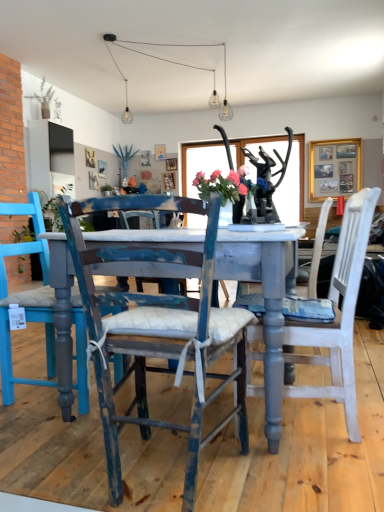
This screenshot has width=384, height=512. I want to click on white painted wood chair at center, which is counted as the second chair, starting from the left, so click(338, 314).

Where is `green leafy plant at upper center, acting as the 1th plant starting from the back`? green leafy plant at upper center, acting as the 1th plant starting from the back is located at coordinates (125, 156).

The width and height of the screenshot is (384, 512). What do you see at coordinates (43, 99) in the screenshot?
I see `white matte vase at upper left, acting as the 1th plant starting from the front` at bounding box center [43, 99].

Identify the location of white painted wood chair at center, which is counted as the second chair, starting from the left. The image size is (384, 512). (338, 314).

In the image, is white painted wood chair at center, which appears as the 1th chair when viewed from the right, on the left side or the right side of pink fabric flowers at center?

In the image, white painted wood chair at center, which appears as the 1th chair when viewed from the right, appears on the right side of pink fabric flowers at center.

Who is more distant, white painted wood chair at center, which appears as the 1th chair when viewed from the right, or pink fabric flowers at center?

Positioned behind is pink fabric flowers at center.

From the image's perspective, does white painted wood chair at center, which is counted as the second chair, starting from the left, appear lower than pink fabric flowers at center?

Correct, white painted wood chair at center, which is counted as the second chair, starting from the left, appears lower than pink fabric flowers at center in the image.

Is white painted wood chair at center, which appears as the 1th chair when viewed from the right, not near pink fabric flowers at center?

white painted wood chair at center, which appears as the 1th chair when viewed from the right, is actually quite close to pink fabric flowers at center.

From the picture: From a real-world perspective, does pink fabric flowers at center sit lower than green leafy plant at upper center, which is the 1th plant from right to left?

Yes, from a real-world perspective, pink fabric flowers at center is beneath green leafy plant at upper center, which is the 1th plant from right to left.

Based on their positions, is pink fabric flowers at center located to the left or right of green leafy plant at upper center, which ranks as the second plant in left-to-right order?

In the image, pink fabric flowers at center appears on the right side of green leafy plant at upper center, which ranks as the second plant in left-to-right order.

Is green leafy plant at upper center, which ranks as the second plant in left-to-right order, a part of pink fabric flowers at center?

No, pink fabric flowers at center does not contain green leafy plant at upper center, which ranks as the second plant in left-to-right order.

Considering the relative sizes of pink fabric flowers at center and green leafy plant at upper center, which ranks as the second plant in left-to-right order, in the image provided, is pink fabric flowers at center bigger than green leafy plant at upper center, which ranks as the second plant in left-to-right order,?

Incorrect, pink fabric flowers at center is not larger than green leafy plant at upper center, which ranks as the second plant in left-to-right order.

Considering the sizes of objects distressed blue wood chair at center, the second chair when ordered from right to left, and green leafy plant at upper center, which ranks as the second plant in left-to-right order, in the image provided, who is smaller, distressed blue wood chair at center, the second chair when ordered from right to left, or green leafy plant at upper center, which ranks as the second plant in left-to-right order,?

green leafy plant at upper center, which ranks as the second plant in left-to-right order.

From the picture: From a real-world perspective, is distressed blue wood chair at center, the second chair when ordered from right to left, positioned over green leafy plant at upper center, acting as the 1th plant starting from the back, based on gravity?

No, from a real-world perspective, distressed blue wood chair at center, the second chair when ordered from right to left, is not over green leafy plant at upper center, acting as the 1th plant starting from the back

Is distressed blue wood chair at center, the first chair in the left-to-right sequence, situated inside green leafy plant at upper center, which ranks as the second plant in left-to-right order, or outside?

distressed blue wood chair at center, the first chair in the left-to-right sequence, is not enclosed by green leafy plant at upper center, which ranks as the second plant in left-to-right order.

Can you confirm if distressed blue wood chair at center, the second chair when ordered from right to left, is shorter than white painted wood chair at center, which appears as the 1th chair when viewed from the right?

Indeed, distressed blue wood chair at center, the second chair when ordered from right to left, has a lesser height compared to white painted wood chair at center, which appears as the 1th chair when viewed from the right.

From the image's perspective, would you say distressed blue wood chair at center, the first chair in the left-to-right sequence, is shown under white painted wood chair at center, which appears as the 1th chair when viewed from the right?

Yes, from the image's perspective, distressed blue wood chair at center, the first chair in the left-to-right sequence, is below white painted wood chair at center, which appears as the 1th chair when viewed from the right.

Measure the distance between distressed blue wood chair at center, the first chair in the left-to-right sequence, and white painted wood chair at center, which appears as the 1th chair when viewed from the right.

distressed blue wood chair at center, the first chair in the left-to-right sequence, and white painted wood chair at center, which appears as the 1th chair when viewed from the right, are 18.36 inches apart.

Is distressed blue wood chair at center, the first chair in the left-to-right sequence, further to the viewer compared to white painted wood chair at center, which is counted as the second chair, starting from the left?

No, distressed blue wood chair at center, the first chair in the left-to-right sequence, is in front of white painted wood chair at center, which is counted as the second chair, starting from the left.

Could white painted wood chair at center, which appears as the 1th chair when viewed from the right, be considered to be inside white matte vase at upper left, the second plant from the back?

No.

Relative to white painted wood chair at center, which appears as the 1th chair when viewed from the right, is white matte vase at upper left, the second plant from the back, in front or behind?

Visually, white matte vase at upper left, the second plant from the back, is located behind white painted wood chair at center, which appears as the 1th chair when viewed from the right.

Does white matte vase at upper left, the second plant from the back, turn towards white painted wood chair at center, which appears as the 1th chair when viewed from the right?

No, white matte vase at upper left, the second plant from the back, is not oriented towards white painted wood chair at center, which appears as the 1th chair when viewed from the right.

Between white matte vase at upper left, the second plant from the back, and white painted wood chair at center, which is counted as the second chair, starting from the left, which one has less height?

white matte vase at upper left, the second plant from the back, is shorter.

Is white painted wood chair at center, which is counted as the second chair, starting from the left, outside of white matte vase at upper left, acting as the 1th plant starting from the front?

Yes, white painted wood chair at center, which is counted as the second chair, starting from the left, is outside of white matte vase at upper left, acting as the 1th plant starting from the front.

From the image's perspective, is white painted wood chair at center, which appears as the 1th chair when viewed from the right, located above white matte vase at upper left, which ranks as the second plant in right-to-left order?

Incorrect, from the image's perspective, white painted wood chair at center, which appears as the 1th chair when viewed from the right, is lower than white matte vase at upper left, which ranks as the second plant in right-to-left order.

Which object is thinner, white painted wood chair at center, which appears as the 1th chair when viewed from the right, or white matte vase at upper left, which appears as the 1th plant when viewed from the left?

white matte vase at upper left, which appears as the 1th plant when viewed from the left.

From a real-world perspective, is white painted wood chair at center, which appears as the 1th chair when viewed from the right, physically below white matte vase at upper left, the second plant from the back?

Yes, from a real-world perspective, white painted wood chair at center, which appears as the 1th chair when viewed from the right, is beneath white matte vase at upper left, the second plant from the back.

Considering the relative sizes of green leafy plant at upper center, positioned as the second plant in front-to-back order, and white painted wood chair at center, which appears as the 1th chair when viewed from the right, in the image provided, is green leafy plant at upper center, positioned as the second plant in front-to-back order, thinner than white painted wood chair at center, which appears as the 1th chair when viewed from the right,?

Indeed, green leafy plant at upper center, positioned as the second plant in front-to-back order, has a lesser width compared to white painted wood chair at center, which appears as the 1th chair when viewed from the right.

Image resolution: width=384 pixels, height=512 pixels. What are the coordinates of `the 1st chair below the green leafy plant at upper center, acting as the 1th plant starting from the back (from a real-world perspective)` in the screenshot? It's located at (338, 314).

From the image's perspective, which object appears higher, green leafy plant at upper center, which is the 1th plant from right to left, or white painted wood chair at center, which appears as the 1th chair when viewed from the right?

green leafy plant at upper center, which is the 1th plant from right to left, from the image's perspective.

Looking at this image, considering the relative sizes of green leafy plant at upper center, acting as the 1th plant starting from the back, and white painted wood chair at center, which appears as the 1th chair when viewed from the right, in the image provided, is green leafy plant at upper center, acting as the 1th plant starting from the back, smaller than white painted wood chair at center, which appears as the 1th chair when viewed from the right,?

Yes.

The height and width of the screenshot is (512, 384). I want to click on the 1st chair below the pink fabric flowers at center (from a real-world perspective), so click(338, 314).

Which plant is the 2nd one when counting from the back of the pink fabric flowers at center? Please provide its 2D coordinates.

[(125, 156)]

When comparing their distances from green leafy plant at upper center, acting as the 1th plant starting from the back, does distressed blue wood chair at center, the first chair in the left-to-right sequence, or pink fabric flowers at center seem further?

distressed blue wood chair at center, the first chair in the left-to-right sequence, lies further to green leafy plant at upper center, acting as the 1th plant starting from the back, than the other object.

Looking at the image, which one is located closer to pink fabric flowers at center, white matte vase at upper left, the second plant from the back, or white painted wood chair at center, which is counted as the second chair, starting from the left?

white painted wood chair at center, which is counted as the second chair, starting from the left.

Considering their positions, is pink fabric flowers at center positioned closer to white matte vase at upper left, the second plant from the back, than white painted wood chair at center, which is counted as the second chair, starting from the left?

Based on the image, pink fabric flowers at center appears to be nearer to white matte vase at upper left, the second plant from the back.

Which object lies further to the anchor point white painted wood chair at center, which appears as the 1th chair when viewed from the right, green leafy plant at upper center, which is the 1th plant from right to left, or distressed blue wood chair at center, the second chair when ordered from right to left?

The object further to white painted wood chair at center, which appears as the 1th chair when viewed from the right, is green leafy plant at upper center, which is the 1th plant from right to left.

Estimate the real-world distances between objects in this image. Which object is further from distressed blue wood chair at center, the second chair when ordered from right to left, white matte vase at upper left, which ranks as the second plant in right-to-left order, or pink fabric flowers at center?

white matte vase at upper left, which ranks as the second plant in right-to-left order, lies further to distressed blue wood chair at center, the second chair when ordered from right to left, than the other object.

Looking at the image, which one is located closer to green leafy plant at upper center, acting as the 1th plant starting from the back, white painted wood chair at center, which appears as the 1th chair when viewed from the right, or white matte vase at upper left, which ranks as the second plant in right-to-left order?

Based on the image, white matte vase at upper left, which ranks as the second plant in right-to-left order, appears to be nearer to green leafy plant at upper center, acting as the 1th plant starting from the back.

Estimate the real-world distances between objects in this image. Which object is closer to pink fabric flowers at center, distressed blue wood chair at center, the second chair when ordered from right to left, or white painted wood chair at center, which is counted as the second chair, starting from the left?

white painted wood chair at center, which is counted as the second chair, starting from the left, is closer to pink fabric flowers at center.

When comparing their distances from distressed blue wood chair at center, the second chair when ordered from right to left, does white matte vase at upper left, acting as the 1th plant starting from the front, or white painted wood chair at center, which is counted as the second chair, starting from the left, seem further?

The object further to distressed blue wood chair at center, the second chair when ordered from right to left, is white matte vase at upper left, acting as the 1th plant starting from the front.

Find the location of a particular element. The height and width of the screenshot is (512, 384). floral arrangement between white painted wood chair at center, which appears as the 1th chair when viewed from the right, and white matte vase at upper left, which ranks as the second plant in right-to-left order, from front to back is located at coordinates (228, 185).

The height and width of the screenshot is (512, 384). I want to click on floral arrangement between white painted wood chair at center, which is counted as the second chair, starting from the left, and green leafy plant at upper center, acting as the 1th plant starting from the back, along the z-axis, so click(x=228, y=185).

What are the coordinates of `floral arrangement between distressed blue wood chair at center, the first chair in the left-to-right sequence, and white matte vase at upper left, which ranks as the second plant in right-to-left order, in the front-back direction` in the screenshot? It's located at (228, 185).

You are a GUI agent. You are given a task and a screenshot of the screen. Output one action in this format:
    pyautogui.click(x=<x>, y=<y>)
    Task: Click on the chair between distressed blue wood chair at center, the first chair in the left-to-right sequence, and pink fabric flowers at center in the front-back direction
    Image resolution: width=384 pixels, height=512 pixels.
    Given the screenshot: What is the action you would take?
    pos(338,314)